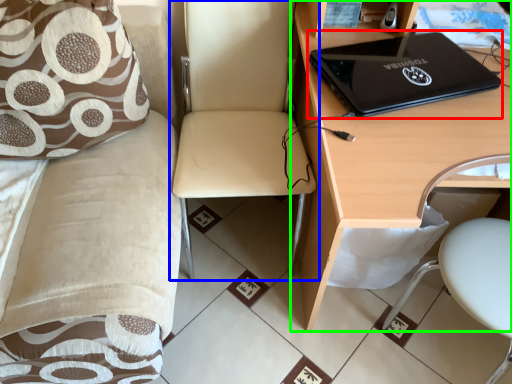
Question: Considering the real-world distances, which object is closest to laptop (highlighted by a red box)? chair (highlighted by a blue box) or desk (highlighted by a green box).

Choices:
 (A) chair
 (B) desk

Answer: (B)